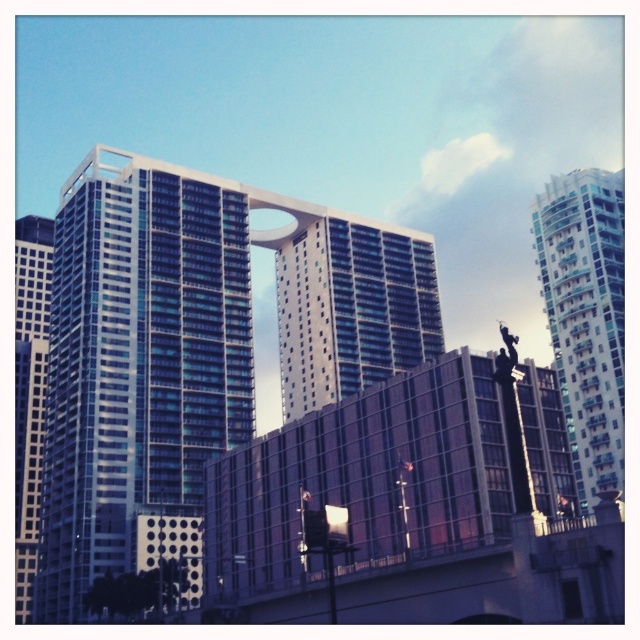
You are standing in the city square and want to take a photo of both the glassy blue skyscraper at center and the white glass building at right. Which building should you move closer to in order to capture both in the same frame?

To capture both the glassy blue skyscraper at center and the white glass building at right in the same frame, you should move closer to the white glass building at right since it is farther away from you compared to the glassy blue skyscraper at center.

You are a drone operator trying to capture a photo of the glassy blue skyscraper at center and the white glass building at right. From your current position, which building should you focus on first to ensure both are in frame without moving the camera?

The glassy blue skyscraper at center is above the white glass building at right, so you should focus on the glassy blue skyscraper at center first to ensure both are in frame without moving the camera.